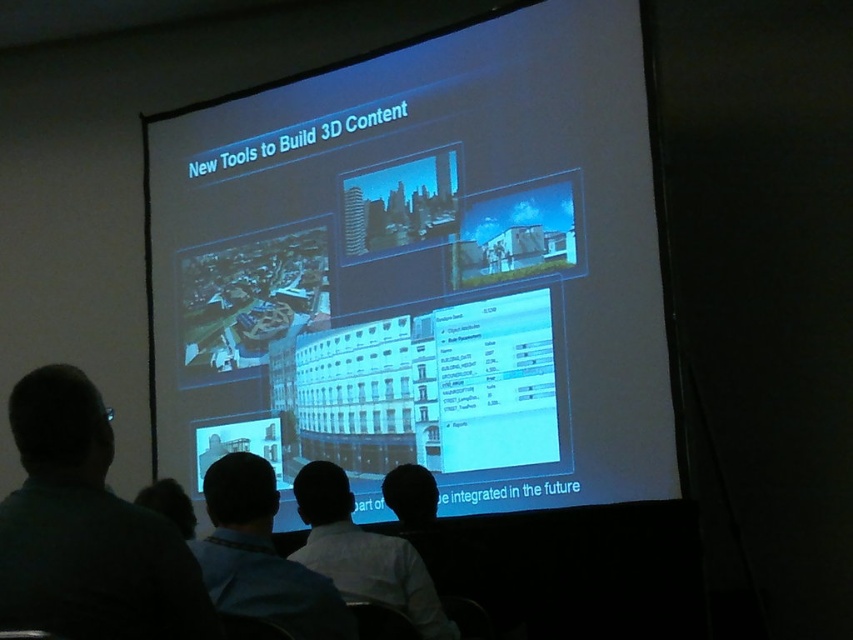
You are an attendee in the presentation. The presenter mentioned a specific point on the screen at coordinates point (422, 269). Where exactly is this point located on the screen?

The point (422, 269) corresponds to the white matte screen at center, so it is located at the center of the screen.

You are an attendee at the presentation. You want to ask a question to the speaker but need to move closer to the front. Currently, you are standing behind the blue shirt at center. Is the white shirt at lower center blocking your path to the front?

The blue shirt at center is in front of the white shirt at lower center, so the white shirt at lower center is behind the blue shirt at center. Therefore, the white shirt at lower center is not blocking your path to the front. You can move forward past the blue shirt at center to get closer.